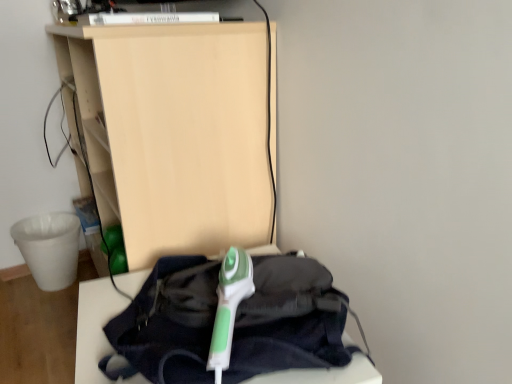
Question: Is green plastic iron at center to the right of green plastic iron at center, positioned as the 1th furniture in bottom-to-top order, from the viewer's perspective?

Choices:
 (A) yes
 (B) no

Answer: (A)

Question: From the image's perspective, is green plastic iron at center located above green plastic iron at center, which is the 2th furniture from top to bottom?

Choices:
 (A) no
 (B) yes

Answer: (B)

Question: From a real-world perspective, is green plastic iron at center under green plastic iron at center, positioned as the 1th furniture in bottom-to-top order?

Choices:
 (A) yes
 (B) no

Answer: (B)

Question: From a real-world perspective, is green plastic iron at center located higher than green plastic iron at center, which is the 2th furniture from top to bottom?

Choices:
 (A) no
 (B) yes

Answer: (B)

Question: Does green plastic iron at center turn towards green plastic iron at center, positioned as the 1th furniture in bottom-to-top order?

Choices:
 (A) yes
 (B) no

Answer: (B)

Question: Considering the relative positions of matte wood shelf at upper center, which is counted as the first furniture, starting from the top, and green plastic iron at center, positioned as the 1th furniture in bottom-to-top order, in the image provided, is matte wood shelf at upper center, which is counted as the first furniture, starting from the top, to the left or to the right of green plastic iron at center, positioned as the 1th furniture in bottom-to-top order,?

Choices:
 (A) left
 (B) right

Answer: (A)

Question: From the image's perspective, is matte wood shelf at upper center, which is counted as the first furniture, starting from the top, positioned above or below green plastic iron at center, positioned as the 1th furniture in bottom-to-top order?

Choices:
 (A) below
 (B) above

Answer: (B)

Question: Is matte wood shelf at upper center, which is counted as the first furniture, starting from the top, spatially inside green plastic iron at center, which is the 2th furniture from top to bottom, or outside of it?

Choices:
 (A) outside
 (B) inside

Answer: (A)

Question: Based on their sizes in the image, would you say matte wood shelf at upper center, which is counted as the first furniture, starting from the top, is bigger or smaller than green plastic iron at center, which is the 2th furniture from top to bottom?

Choices:
 (A) big
 (B) small

Answer: (A)

Question: Would you say green plastic iron at center is to the left or to the right of green plastic iron at center, which is the 2th furniture from top to bottom, in the picture?

Choices:
 (A) left
 (B) right

Answer: (B)

Question: From a real-world perspective, is green plastic iron at center above or below green plastic iron at center, which is the 2th furniture from top to bottom?

Choices:
 (A) below
 (B) above

Answer: (B)

Question: Based on their sizes in the image, would you say green plastic iron at center is bigger or smaller than green plastic iron at center, positioned as the 1th furniture in bottom-to-top order?

Choices:
 (A) small
 (B) big

Answer: (A)

Question: Is green plastic iron at center spatially inside green plastic iron at center, which is the 2th furniture from top to bottom, or outside of it?

Choices:
 (A) inside
 (B) outside

Answer: (B)

Question: From a real-world perspective, is green plastic iron at center, positioned as the 1th furniture in bottom-to-top order, positioned above or below matte wood shelf at upper center, the 2th furniture in the bottom-to-top sequence?

Choices:
 (A) above
 (B) below

Answer: (B)

Question: From their relative heights in the image, would you say green plastic iron at center, positioned as the 1th furniture in bottom-to-top order, is taller or shorter than matte wood shelf at upper center, the 2th furniture in the bottom-to-top sequence?

Choices:
 (A) short
 (B) tall

Answer: (A)